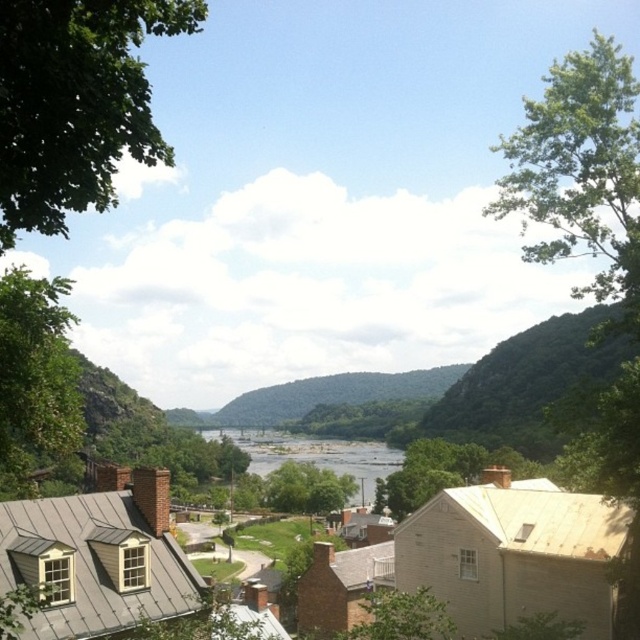
Between point (109, 152) and point (560, 81), which one is positioned behind?

The point (560, 81) is more distant.

Consider the image. Between green leafy tree at upper left and green leafy tree at upper right, which one is positioned higher?

Positioned higher is green leafy tree at upper right.

What do you see at coordinates (76, 104) in the screenshot?
I see `green leafy tree at upper left` at bounding box center [76, 104].

Image resolution: width=640 pixels, height=640 pixels. I want to click on green leafy tree at upper left, so click(76, 104).

You are a GUI agent. You are given a task and a screenshot of the screen. Output one action in this format:
    pyautogui.click(x=<x>, y=<y>)
    Task: Click on the green leafy tree at left
    The height and width of the screenshot is (640, 640).
    Given the screenshot: What is the action you would take?
    pyautogui.click(x=35, y=378)

Is point (61, 454) positioned after point (346, 470)?

No, it is in front of (346, 470).

Where is `green leafy tree at left`? green leafy tree at left is located at coordinates (35, 378).

The height and width of the screenshot is (640, 640). I want to click on green leafy tree at left, so click(35, 378).

Based on the photo, who is shorter, green leafy tree at upper right or clear water at center?

Standing shorter between the two is clear water at center.

Is green leafy tree at upper right thinner than clear water at center?

Incorrect, green leafy tree at upper right's width is not less than clear water at center's.

Between point (580, 76) and point (333, 456), which one is positioned in front?

Point (580, 76)

Find the location of a particular element. The height and width of the screenshot is (640, 640). green leafy tree at upper right is located at coordinates (580, 168).